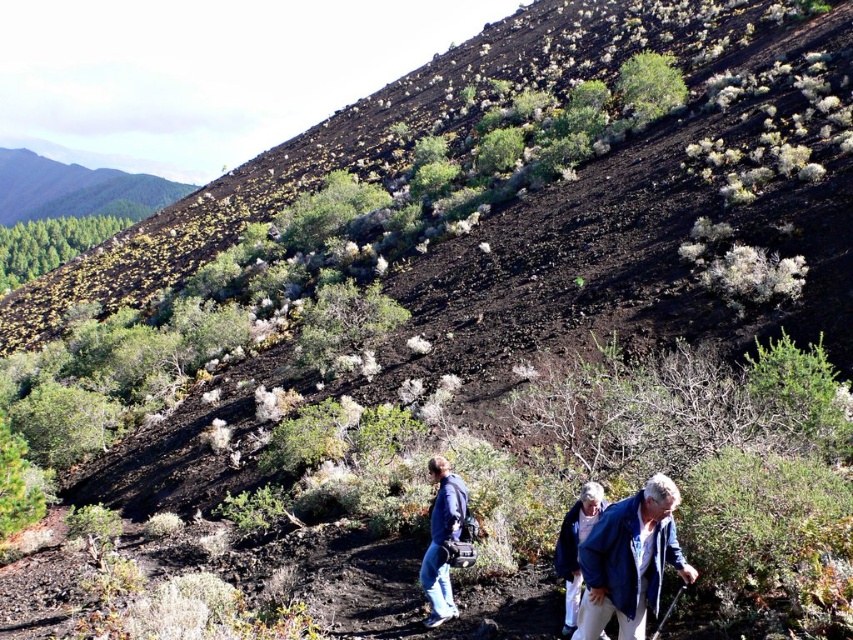
The height and width of the screenshot is (640, 853). I want to click on blue fabric jacket at center, so [631, 552].

Is blue fabric jacket at center smaller than blue denim jacket at lower right?

Indeed, blue fabric jacket at center has a smaller size compared to blue denim jacket at lower right.

Who is more distant from viewer, (583, 557) or (654, 598)?

The point (583, 557) is behind.

The height and width of the screenshot is (640, 853). Identify the location of blue fabric jacket at center. (631, 552).

Between point (633, 602) and point (451, 496), which one is positioned behind?

Positioned behind is point (451, 496).

What are the coordinates of `blue fabric jacket at center` in the screenshot? It's located at (631, 552).

Does blue denim jacket at lower right appear on the left side of blue denim jacket at center?

No, blue denim jacket at lower right is not to the left of blue denim jacket at center.

Is blue denim jacket at lower right to the right of blue denim jacket at center from the viewer's perspective?

Yes, blue denim jacket at lower right is to the right of blue denim jacket at center.

Which is behind, point (621, 572) or point (457, 486)?

Positioned behind is point (457, 486).

What are the coordinates of `blue denim jacket at lower right` in the screenshot? It's located at (630, 561).